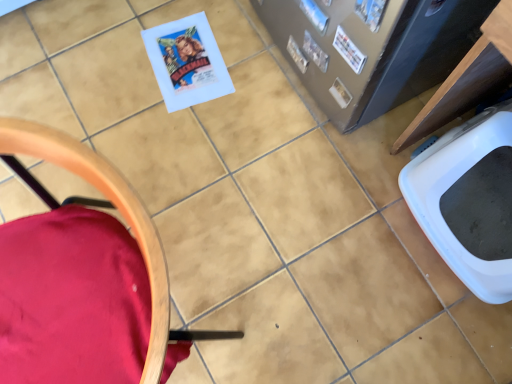
Find the location of a particular element. Image resolution: width=512 pixels, height=384 pixels. white paper comic book at upper right, the 2th comic book positioned from the back is located at coordinates (x=349, y=50).

Describe the element at coordinates (371, 12) in the screenshot. I see `matte paper comic book at upper right, the third comic book from the back` at that location.

Describe the element at coordinates (314, 15) in the screenshot. I see `blue glossy comic book at upper right, the 3th comic book viewed from the front` at that location.

What is the approximate width of velvet red chair at lower left?

It is 19.30 inches.

The height and width of the screenshot is (384, 512). What do you see at coordinates (469, 200) in the screenshot?
I see `white plastic toilet bowl at lower right` at bounding box center [469, 200].

You are a GUI agent. You are given a task and a screenshot of the screen. Output one action in this format:
    pyautogui.click(x=<x>, y=<y>)
    Task: Click on the white paper comic book at upper right, which appears as the second comic book when viewed from the front
    
    Given the screenshot: What is the action you would take?
    coord(349,50)

From the image's perspective, is white paper comic book at upper right, which appears as the second comic book when viewed from the front, over matte paper comic book at upper right, the third comic book from the back?

No, from the image's perspective, white paper comic book at upper right, which appears as the second comic book when viewed from the front, is not over matte paper comic book at upper right, the third comic book from the back.

Between white paper comic book at upper right, which appears as the second comic book when viewed from the front, and matte paper comic book at upper right, acting as the 1th comic book starting from the front, which one has larger size?

With larger size is matte paper comic book at upper right, acting as the 1th comic book starting from the front.

How many degrees apart are the facing directions of white paper comic book at upper right, the 2th comic book positioned from the back, and matte paper comic book at upper right, the third comic book from the back?

There is a 0.0122-degree angle between the facing directions of white paper comic book at upper right, the 2th comic book positioned from the back, and matte paper comic book at upper right, the third comic book from the back.

Considering the relative sizes of white paper comic book at upper right, the 2th comic book positioned from the back, and matte paper comic book at upper right, acting as the 1th comic book starting from the front, in the image provided, is white paper comic book at upper right, the 2th comic book positioned from the back, shorter than matte paper comic book at upper right, acting as the 1th comic book starting from the front,?

Indeed, white paper comic book at upper right, the 2th comic book positioned from the back, has a lesser height compared to matte paper comic book at upper right, acting as the 1th comic book starting from the front.

From the image's perspective, which one is positioned lower, white plastic toilet bowl at lower right or white paper comic book at upper right, the 2th comic book positioned from the back?

white plastic toilet bowl at lower right, from the image's perspective.

From a real-world perspective, is white plastic toilet bowl at lower right above or below white paper comic book at upper right, the 2th comic book positioned from the back?

In terms of real-world spatial position, white plastic toilet bowl at lower right is below white paper comic book at upper right, the 2th comic book positioned from the back.

Is white plastic toilet bowl at lower right inside the boundaries of white paper comic book at upper right, which appears as the second comic book when viewed from the front, or outside?

white plastic toilet bowl at lower right lies outside white paper comic book at upper right, which appears as the second comic book when viewed from the front.

Looking at their sizes, would you say white plastic toilet bowl at lower right is wider or thinner than white paper comic book at upper right, the 2th comic book positioned from the back?

Considering their sizes, white plastic toilet bowl at lower right looks broader than white paper comic book at upper right, the 2th comic book positioned from the back.

Does white paper comic book at upper right, the 2th comic book positioned from the back, have a greater width compared to blue glossy comic book at upper right, positioned as the first comic book in back-to-front order?

Yes, white paper comic book at upper right, the 2th comic book positioned from the back, is wider than blue glossy comic book at upper right, positioned as the first comic book in back-to-front order.

Can you confirm if white paper comic book at upper right, which appears as the second comic book when viewed from the front, is smaller than blue glossy comic book at upper right, the 3th comic book viewed from the front?

Yes, white paper comic book at upper right, which appears as the second comic book when viewed from the front, is smaller than blue glossy comic book at upper right, the 3th comic book viewed from the front.

Do you think white paper comic book at upper right, the 2th comic book positioned from the back, is within blue glossy comic book at upper right, positioned as the first comic book in back-to-front order, or outside of it?

white paper comic book at upper right, the 2th comic book positioned from the back, is spatially situated outside blue glossy comic book at upper right, positioned as the first comic book in back-to-front order.

Between white paper comic book at upper right, which appears as the second comic book when viewed from the front, and blue glossy comic book at upper right, positioned as the first comic book in back-to-front order, which one has less height?

Standing shorter between the two is white paper comic book at upper right, which appears as the second comic book when viewed from the front.

I want to click on toilet bowl above the velvet red chair at lower left (from the image's perspective), so (469, 200).

Could you tell me if white plastic toilet bowl at lower right is facing velvet red chair at lower left?

Yes, white plastic toilet bowl at lower right faces towards velvet red chair at lower left.

Based on their positions, is white plastic toilet bowl at lower right located to the left or right of velvet red chair at lower left?

white plastic toilet bowl at lower right is to the right of velvet red chair at lower left.

Consider the image. From the image's perspective, is white paper comic book at upper right, which appears as the second comic book when viewed from the front, above white plastic toilet bowl at lower right?

Correct, white paper comic book at upper right, which appears as the second comic book when viewed from the front, appears higher than white plastic toilet bowl at lower right in the image.

Does white paper comic book at upper right, the 2th comic book positioned from the back, have a smaller size compared to white plastic toilet bowl at lower right?

Yes.

Between white paper comic book at upper right, which appears as the second comic book when viewed from the front, and white plastic toilet bowl at lower right, which one has more height?

Standing taller between the two is white plastic toilet bowl at lower right.

Is white paper comic book at upper right, the 2th comic book positioned from the back, directly adjacent to white plastic toilet bowl at lower right?

→ white paper comic book at upper right, the 2th comic book positioned from the back, and white plastic toilet bowl at lower right are not in contact.

From the image's perspective, would you say velvet red chair at lower left is positioned over matte paper comic book at upper right, acting as the 1th comic book starting from the front?

No, from the image's perspective, velvet red chair at lower left is not over matte paper comic book at upper right, acting as the 1th comic book starting from the front.

Between velvet red chair at lower left and matte paper comic book at upper right, the third comic book from the back, which one has more height?

With more height is velvet red chair at lower left.

Is velvet red chair at lower left next to matte paper comic book at upper right, the third comic book from the back, and touching it?

No, velvet red chair at lower left is not with matte paper comic book at upper right, the third comic book from the back.

From the image's perspective, which comic book is the 2nd one above the velvet red chair at lower left? Please provide its 2D coordinates.

[(371, 12)]

Does blue glossy comic book at upper right, positioned as the first comic book in back-to-front order, appear on the right side of white plastic toilet bowl at lower right?

No.

Is blue glossy comic book at upper right, the 3th comic book viewed from the front, situated inside white plastic toilet bowl at lower right or outside?

blue glossy comic book at upper right, the 3th comic book viewed from the front, is not inside white plastic toilet bowl at lower right, it's outside.

Does point (321, 34) appear closer or farther from the camera than point (446, 223)?

Point (321, 34) is closer to the camera than point (446, 223).

Image resolution: width=512 pixels, height=384 pixels. I want to click on the 1st comic book counting from the left of the matte paper comic book at upper right, the third comic book from the back, so click(349, 50).

In order to click on toilet bowl to the right of white paper comic book at upper right, which appears as the second comic book when viewed from the front in this screenshot , I will do `click(469, 200)`.

Based on the photo, estimate the real-world distances between objects in this image. Which object is closer to white plastic toilet bowl at lower right, velvet red chair at lower left or blue glossy comic book at upper right, the 3th comic book viewed from the front?

Among the two, blue glossy comic book at upper right, the 3th comic book viewed from the front, is located nearer to white plastic toilet bowl at lower right.

From the image, which object appears to be nearer to blue glossy comic book at upper right, the 3th comic book viewed from the front, velvet red chair at lower left or white paper comic book at upper right, which appears as the second comic book when viewed from the front?

The object closer to blue glossy comic book at upper right, the 3th comic book viewed from the front, is white paper comic book at upper right, which appears as the second comic book when viewed from the front.

Based on the photo, from the image, which object appears to be farther from velvet red chair at lower left, white paper comic book at upper right, the 2th comic book positioned from the back, or matte paper comic book at upper right, acting as the 1th comic book starting from the front?

white paper comic book at upper right, the 2th comic book positioned from the back, is further to velvet red chair at lower left.

Considering their positions, is white plastic toilet bowl at lower right positioned further to matte paper comic book at upper right, the third comic book from the back, than white paper comic book at upper right, which appears as the second comic book when viewed from the front?

white plastic toilet bowl at lower right is positioned further to the anchor matte paper comic book at upper right, the third comic book from the back.

From the image, which object appears to be farther from white paper comic book at upper right, the 2th comic book positioned from the back, blue glossy comic book at upper right, the 3th comic book viewed from the front, or matte paper comic book at upper right, the third comic book from the back?

Among the two, matte paper comic book at upper right, the third comic book from the back, is located further to white paper comic book at upper right, the 2th comic book positioned from the back.

Which object lies further to the anchor point white paper comic book at upper right, the 2th comic book positioned from the back, matte paper comic book at upper right, the third comic book from the back, or blue glossy comic book at upper right, the 3th comic book viewed from the front?

matte paper comic book at upper right, the third comic book from the back.

Which object lies further to the anchor point white paper comic book at upper right, the 2th comic book positioned from the back, white plastic toilet bowl at lower right or matte paper comic book at upper right, acting as the 1th comic book starting from the front?

Based on the image, white plastic toilet bowl at lower right appears to be further to white paper comic book at upper right, the 2th comic book positioned from the back.

Estimate the real-world distances between objects in this image. Which object is closer to blue glossy comic book at upper right, the 3th comic book viewed from the front, white plastic toilet bowl at lower right or white paper comic book at upper right, which appears as the second comic book when viewed from the front?

Based on the image, white paper comic book at upper right, which appears as the second comic book when viewed from the front, appears to be nearer to blue glossy comic book at upper right, the 3th comic book viewed from the front.

The height and width of the screenshot is (384, 512). What are the coordinates of `comic book positioned between matte paper comic book at upper right, acting as the 1th comic book starting from the front, and blue glossy comic book at upper right, positioned as the first comic book in back-to-front order, from near to far` in the screenshot? It's located at (349, 50).

What are the coordinates of `comic book that lies between matte paper comic book at upper right, acting as the 1th comic book starting from the front, and velvet red chair at lower left from top to bottom` in the screenshot? It's located at (349, 50).

You are a GUI agent. You are given a task and a screenshot of the screen. Output one action in this format:
    pyautogui.click(x=<x>, y=<y>)
    Task: Click on the comic book between white paper comic book at upper right, which appears as the second comic book when viewed from the front, and white plastic toilet bowl at lower right, in the horizontal direction
    This screenshot has width=512, height=384.
    Given the screenshot: What is the action you would take?
    pyautogui.click(x=371, y=12)